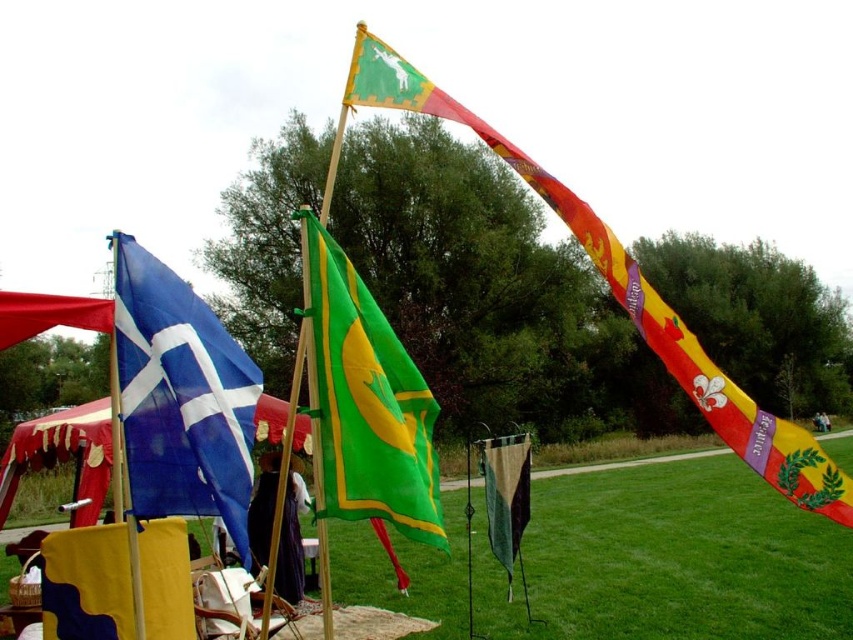
Question: Is green matte flag at center below camouflage fabric flag at lower left?

Choices:
 (A) no
 (B) yes

Answer: (A)

Question: Is green grass at center thinner than green fabric flag at upper center?

Choices:
 (A) no
 (B) yes

Answer: (A)

Question: Which object is positioned closest to the green fabric flag at upper center?

Choices:
 (A) camouflage fabric flag at lower left
 (B) green grass at center

Answer: (A)

Question: Does blue fabric flag at left have a smaller size compared to green matte flag at center?

Choices:
 (A) no
 (B) yes

Answer: (B)

Question: Which object appears closest to the camera in this image?

Choices:
 (A) camouflage fabric flag at center
 (B) green fabric flag at upper center

Answer: (B)

Question: Which point appears farthest from the camera in this image?

Choices:
 (A) (492, 544)
 (B) (778, 604)
 (C) (395, 368)
 (D) (167, 456)

Answer: (B)